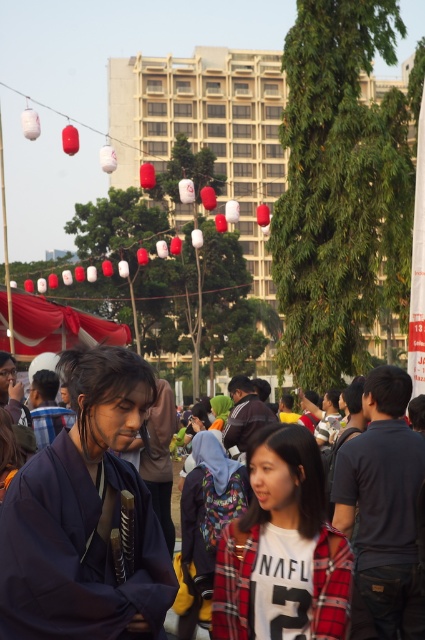
Question: Which object is the closest to the purple fabric kimono at center?

Choices:
 (A) plaid fabric jacket at center
 (B) red fabric canopy at center

Answer: (A)

Question: Which point is closer to the camera?

Choices:
 (A) white cotton shirt at center
 (B) purple fabric kimono at center
 (C) plaid fabric jacket at center
 (D) red fabric canopy at center

Answer: (B)

Question: Does white cotton shirt at center have a lesser width compared to red fabric canopy at center?

Choices:
 (A) no
 (B) yes

Answer: (B)

Question: Which point is farther to the camera?

Choices:
 (A) (78, 390)
 (B) (99, 422)
 (C) (62, 332)
 (D) (240, 557)

Answer: (C)

Question: Is plaid fabric jacket at center to the right of white cotton shirt at center from the viewer's perspective?

Choices:
 (A) yes
 (B) no

Answer: (B)

Question: Can you confirm if purple fabric kimono at center is smaller than plaid fabric jacket at center?

Choices:
 (A) no
 (B) yes

Answer: (B)